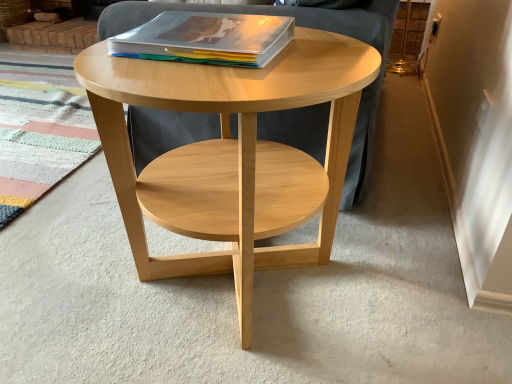
Locate an element on the screen. This screenshot has width=512, height=384. vacant space positioned to the left of natural wood coffee table at center is located at coordinates (68, 258).